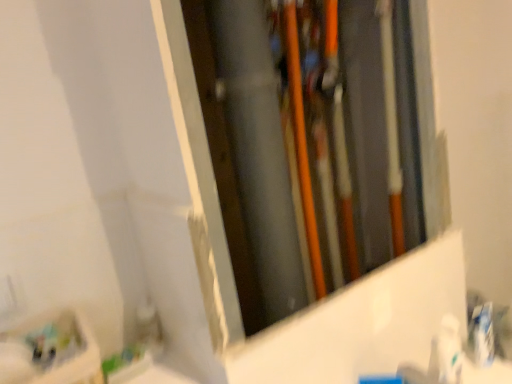
Describe the element at coordinates (448, 350) in the screenshot. I see `white glossy toothpaste at lower right` at that location.

In order to click on white glossy toothpaste at lower right in this screenshot , I will do `click(448, 350)`.

What do you see at coordinates (482, 334) in the screenshot?
I see `white glossy toothpaste at right` at bounding box center [482, 334].

Locate an element on the screen. The height and width of the screenshot is (384, 512). white glossy toothpaste at right is located at coordinates 482,334.

Measure the distance between white glossy toothpaste at right and camera.

white glossy toothpaste at right is 36.67 inches from camera.

Find the location of `white glossy toothpaste at lower right`. white glossy toothpaste at lower right is located at coordinates (448, 350).

Which object is positioned more to the left, white glossy toothpaste at right or white glossy toothpaste at lower right?

Positioned to the left is white glossy toothpaste at lower right.

Which object is closer to the camera, white glossy toothpaste at right or white glossy toothpaste at lower right?

white glossy toothpaste at lower right is more forward.

Considering the positions of point (487, 338) and point (446, 345), is point (487, 338) closer or farther from the camera than point (446, 345)?

Point (487, 338) is farther from the camera than point (446, 345).

From the image's perspective, is white glossy toothpaste at right located above white glossy toothpaste at lower right?

Correct, white glossy toothpaste at right appears higher than white glossy toothpaste at lower right in the image.

From a real-world perspective, is white glossy toothpaste at right positioned above or below white glossy toothpaste at lower right?

white glossy toothpaste at right is situated lower than white glossy toothpaste at lower right in the real world.

Which object is thinner, white glossy toothpaste at right or white glossy toothpaste at lower right?

Thinner between the two is white glossy toothpaste at right.

Considering the sizes of objects white glossy toothpaste at right and white glossy toothpaste at lower right in the image provided, who is shorter, white glossy toothpaste at right or white glossy toothpaste at lower right?

white glossy toothpaste at right is shorter.

Who is smaller, white glossy toothpaste at right or white glossy toothpaste at lower right?

Smaller between the two is white glossy toothpaste at right.

Does white glossy toothpaste at right contain white glossy toothpaste at lower right?

Actually, white glossy toothpaste at lower right is outside white glossy toothpaste at right.

Would you say white glossy toothpaste at right is a long distance from white glossy toothpaste at lower right?

No, there isn't a large distance between white glossy toothpaste at right and white glossy toothpaste at lower right.

Is white glossy toothpaste at right facing away from white glossy toothpaste at lower right?

No, white glossy toothpaste at right is not facing the opposite direction of white glossy toothpaste at lower right.

What's the angular difference between white glossy toothpaste at right and white glossy toothpaste at lower right's facing directions?

There is a 9.47-degree angle between the facing directions of white glossy toothpaste at right and white glossy toothpaste at lower right.

The image size is (512, 384). I want to click on toothpaste above the white glossy toothpaste at lower right (from the image's perspective), so click(x=482, y=334).

Considering the positions of objects white glossy toothpaste at lower right and white glossy toothpaste at right in the image provided, who is more to the left, white glossy toothpaste at lower right or white glossy toothpaste at right?

From the viewer's perspective, white glossy toothpaste at lower right appears more on the left side.

Which object is closer to the camera taking this photo, white glossy toothpaste at lower right or white glossy toothpaste at right?

white glossy toothpaste at lower right is closer to the camera.

Is point (455, 346) farther from camera compared to point (477, 321)?

No, (455, 346) is closer to viewer.

From the image's perspective, relative to white glossy toothpaste at right, is white glossy toothpaste at lower right above or below?

Clearly, from the image's perspective, white glossy toothpaste at lower right is below white glossy toothpaste at right.

From a real-world perspective, is white glossy toothpaste at lower right positioned above or below white glossy toothpaste at right?

From a real-world perspective, white glossy toothpaste at lower right is physically above white glossy toothpaste at right.

Between white glossy toothpaste at lower right and white glossy toothpaste at right, which one has smaller width?

white glossy toothpaste at right.

Which of these two, white glossy toothpaste at lower right or white glossy toothpaste at right, stands taller?

Standing taller between the two is white glossy toothpaste at lower right.

Considering the relative sizes of white glossy toothpaste at lower right and white glossy toothpaste at right in the image provided, is white glossy toothpaste at lower right smaller than white glossy toothpaste at right?

No.

Is white glossy toothpaste at lower right situated inside white glossy toothpaste at right or outside?

white glossy toothpaste at lower right is not inside white glossy toothpaste at right, it's outside.

Is white glossy toothpaste at lower right far away from white glossy toothpaste at right?

white glossy toothpaste at lower right is near white glossy toothpaste at right, not far away.

Could you tell me if white glossy toothpaste at lower right is turned towards white glossy toothpaste at right?

No, white glossy toothpaste at lower right is not aimed at white glossy toothpaste at right.

Find the location of `toothpaste below the white glossy toothpaste at lower right (from a real-world perspective)`. toothpaste below the white glossy toothpaste at lower right (from a real-world perspective) is located at coordinates (482, 334).

Find the location of a particular element. toiletry on the left of white glossy toothpaste at right is located at coordinates (448, 350).

The width and height of the screenshot is (512, 384). Identify the location of toothpaste behind the white glossy toothpaste at lower right. (482, 334).